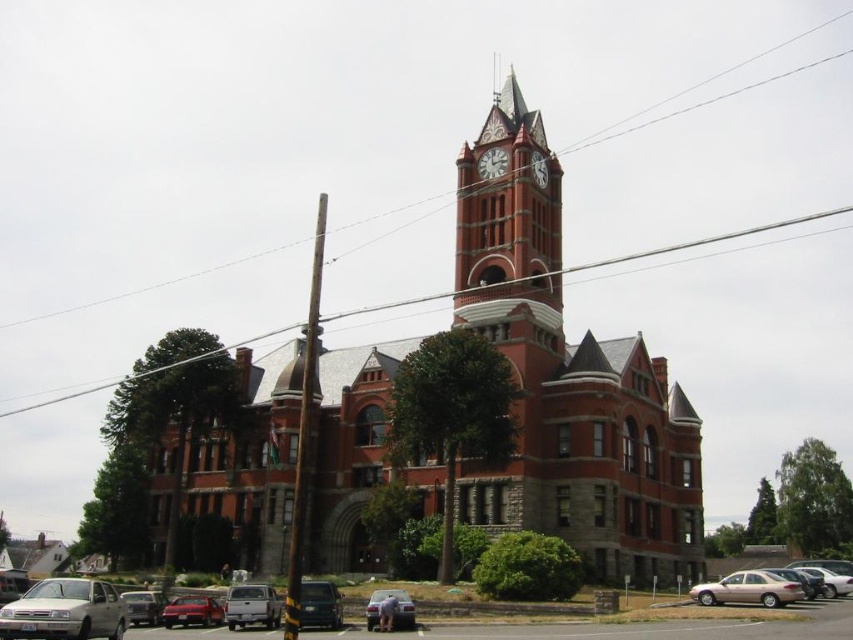
Question: Which point is closer to the camera?

Choices:
 (A) smooth gray pole at center
 (B) polished brass clock at upper center
 (C) metallic silver van at lower left
 (D) metallic gray van at lower center

Answer: (A)

Question: Considering the relative positions of red brick church at center and shiny red sedan at lower left in the image provided, where is red brick church at center located with respect to shiny red sedan at lower left?

Choices:
 (A) left
 (B) right

Answer: (B)

Question: Which point is closer to the camera?

Choices:
 (A) metallic silver van at lower left
 (B) metallic gray van at lower center
 (C) matte black sedan at lower left
 (D) gold metallic sedan at lower right

Answer: (B)

Question: Can you confirm if metallic gray van at lower center is positioned to the right of metallic silver car at lower center?

Choices:
 (A) yes
 (B) no

Answer: (B)

Question: Which point is farther from the camera taking this photo?

Choices:
 (A) tap(485, 173)
 (B) tap(97, 611)
 (C) tap(169, 616)
 (D) tap(264, 614)

Answer: (A)

Question: Can you confirm if metallic wire at upper center is positioned above shiny red sedan at lower left?

Choices:
 (A) yes
 (B) no

Answer: (A)